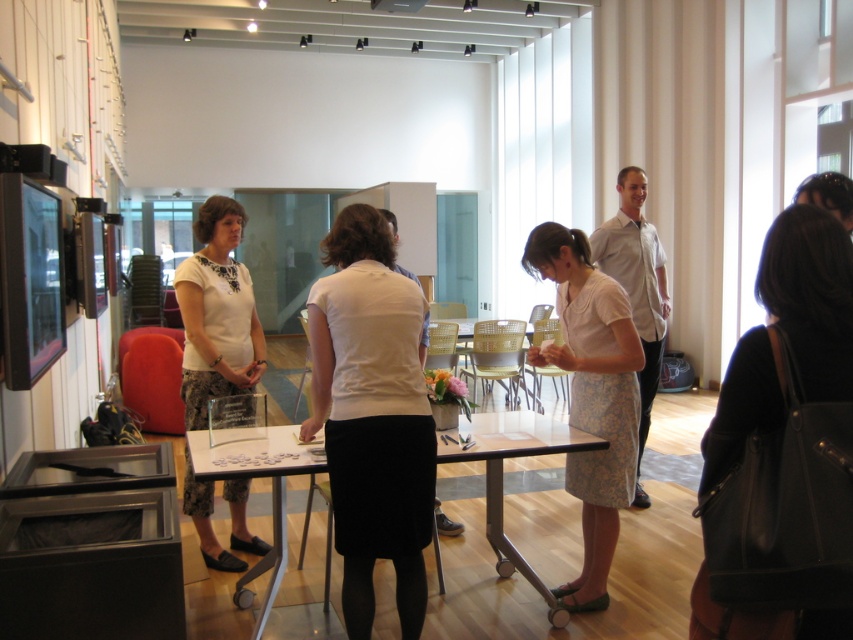
Is white matte skirt at center to the left of floral-patterned skirt at center from the viewer's perspective?

Correct, you'll find white matte skirt at center to the left of floral-patterned skirt at center.

Between point (415, 525) and point (590, 397), which one is positioned in front?

Point (415, 525) is more forward.

Image resolution: width=853 pixels, height=640 pixels. I want to click on white matte skirt at center, so click(x=372, y=417).

Can you confirm if white matte skirt at center is shorter than clear glass table at center?

No.

Who is more forward, (376, 412) or (274, 552)?

Point (376, 412)

Where is `white matte skirt at center`? white matte skirt at center is located at coordinates (372, 417).

Does black leather bag at lower right appear over clear glass table at center?

Indeed, black leather bag at lower right is positioned over clear glass table at center.

Is black leather bag at lower right taller than clear glass table at center?

Correct, black leather bag at lower right is much taller as clear glass table at center.

Is point (816, 426) in front of point (257, 442)?

That is True.

At what (x,y) coordinates should I click in order to perform the action: click on black leather bag at lower right. Please return your answer as a coordinate pair (x, y). Looking at the image, I should click on (782, 451).